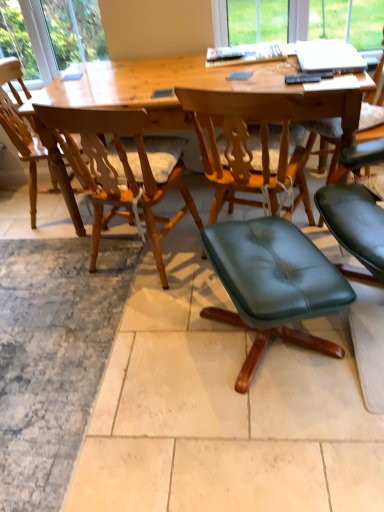
Identify the location of vacant region under green leather ottoman at lower right, marked as the 2th chair in a right-to-left arrangement (from a real-world perspective). (259, 352).